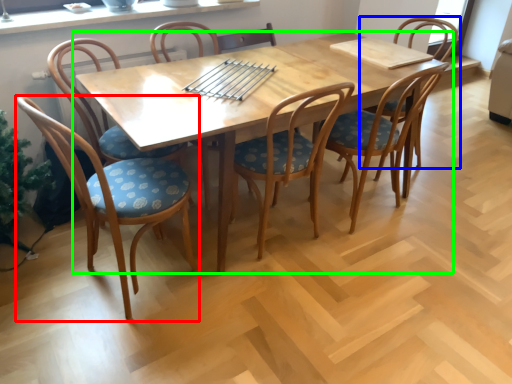
Question: Based on their relative distances, which object is nearer to chair (highlighted by a red box)? Choose from chair (highlighted by a blue box) and kitchen & dining room table (highlighted by a green box).

Choices:
 (A) chair
 (B) kitchen & dining room table

Answer: (B)